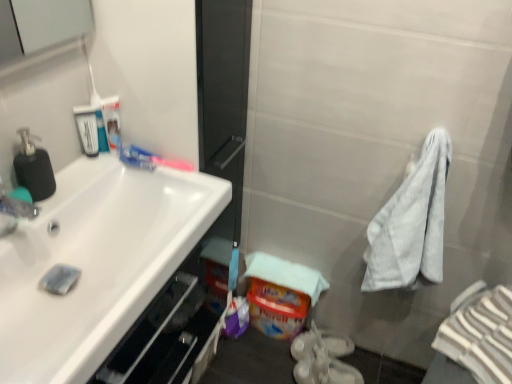
Where is `vacant space to the right of white plastic mouthwash at upper left, acting as the 1th mouthwash starting from the left`? This screenshot has width=512, height=384. vacant space to the right of white plastic mouthwash at upper left, acting as the 1th mouthwash starting from the left is located at coordinates (132, 165).